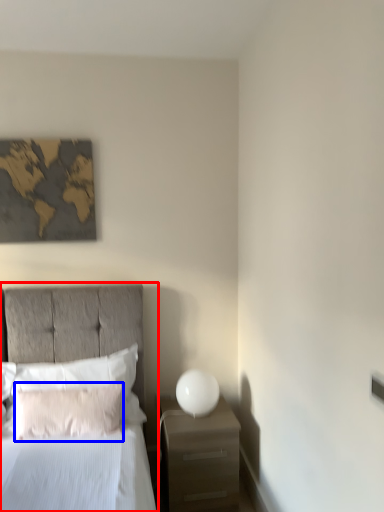
Question: Which point is further to the camera, bed (highlighted by a red box) or pillow (highlighted by a blue box)?

Choices:
 (A) bed
 (B) pillow

Answer: (B)